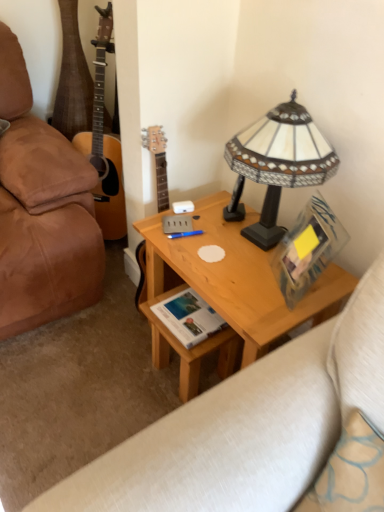
At what (x,y) coordinates should I click in order to perform the action: click on vacant area that lies to the right of blue plastic pen at center. Please return your answer as a coordinate pair (x, y). Looking at the image, I should click on (236, 238).